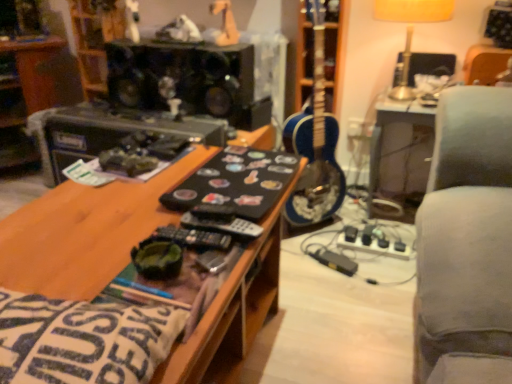
Question: Does black matte speaker at upper center turn towards blue glossy guitar at center?

Choices:
 (A) yes
 (B) no

Answer: (B)

Question: Could blue glossy guitar at center be considered to be inside black matte speaker at upper center?

Choices:
 (A) no
 (B) yes

Answer: (A)

Question: Is the position of black matte speaker at upper center less distant than that of blue glossy guitar at center?

Choices:
 (A) yes
 (B) no

Answer: (A)

Question: From the image's perspective, is black matte speaker at upper center beneath blue glossy guitar at center?

Choices:
 (A) no
 (B) yes

Answer: (A)

Question: Is black matte speaker at upper center looking in the opposite direction of blue glossy guitar at center?

Choices:
 (A) no
 (B) yes

Answer: (A)

Question: Is black matte speaker at upper center at the right side of blue glossy guitar at center?

Choices:
 (A) yes
 (B) no

Answer: (B)

Question: Is black matte speaker at upper center facing away from matte plastic toy at upper center, which is the 1th toy from right to left?

Choices:
 (A) yes
 (B) no

Answer: (B)

Question: Is matte plastic toy at upper center, which is the 1th toy from right to left, inside black matte speaker at upper center?

Choices:
 (A) yes
 (B) no

Answer: (B)

Question: Would you say black matte speaker at upper center is a long distance from matte plastic toy at upper center, which is the 1th toy from right to left?

Choices:
 (A) yes
 (B) no

Answer: (B)

Question: Is black matte speaker at upper center in contact with matte plastic toy at upper center, which is the 1th toy from right to left?

Choices:
 (A) yes
 (B) no

Answer: (B)

Question: Does black matte speaker at upper center appear on the left side of matte plastic toy at upper center, the 3th toy in the left-to-right sequence?

Choices:
 (A) yes
 (B) no

Answer: (A)

Question: Is black matte speaker at upper center thinner than matte plastic toy at upper center, which is the 1th toy from right to left?

Choices:
 (A) no
 (B) yes

Answer: (A)

Question: Can you confirm if white matte toy at upper center, which is counted as the third toy, starting from the right, is wider than black matte speaker at upper center?

Choices:
 (A) no
 (B) yes

Answer: (A)